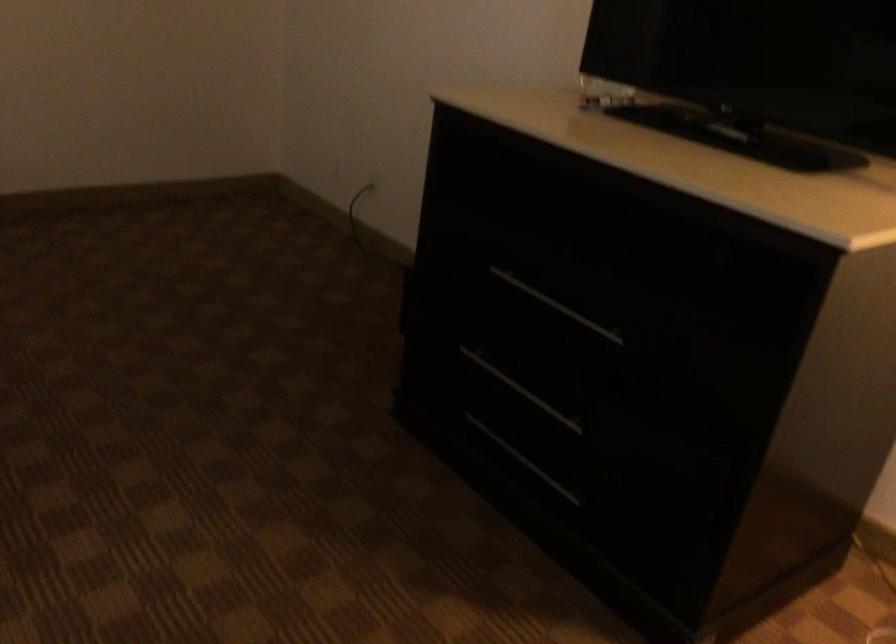
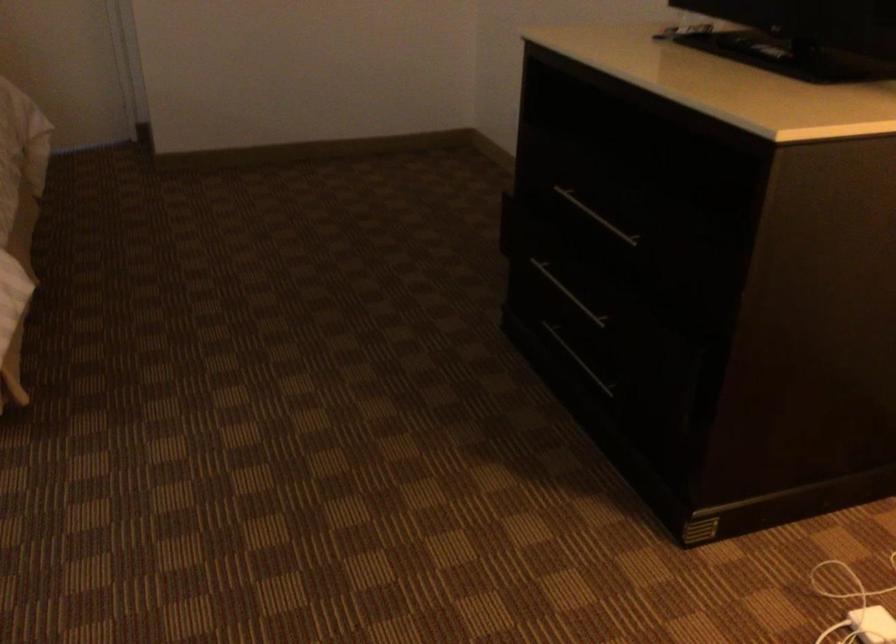
Locate, in the second image, the point that corresponds to point 553,305 in the first image.

(596, 216)